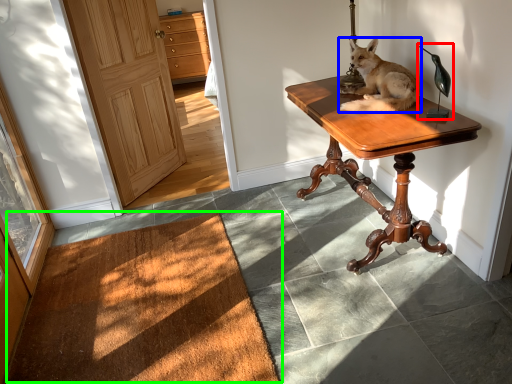
Question: Estimate the real-world distances between objects in this image. Which object is closer to table lamp (highlighted by a red box), dog (highlighted by a blue box) or doormat (highlighted by a green box)?

Choices:
 (A) dog
 (B) doormat

Answer: (A)